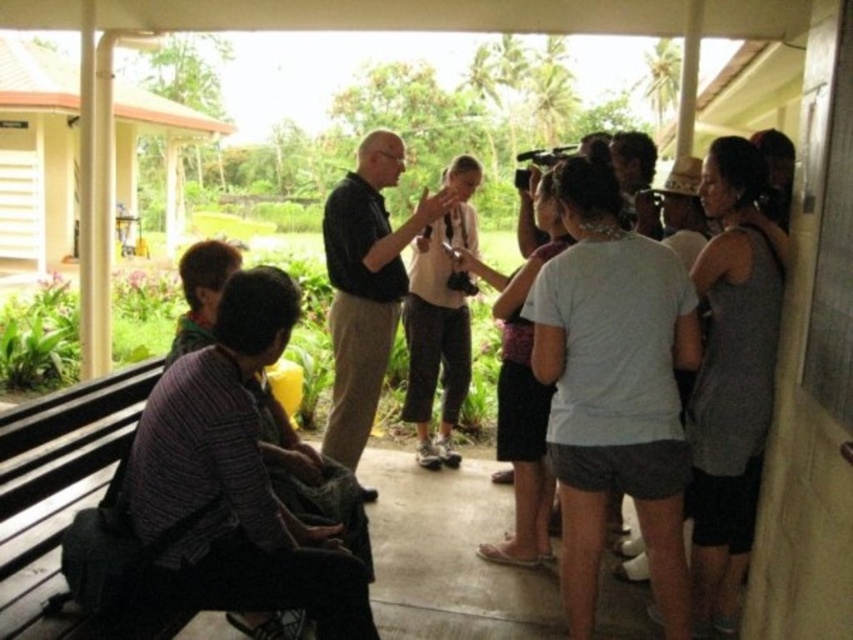
Consider the image. You are a photographer at the event and want to capture a photo of the group. You are currently standing behind the wooden bench at lower left. To frame the black matte shirt at center properly in your shot, should you move to your right or left?

The wooden bench at lower left is positioned on the left side of black matte shirt at center. To frame the black matte shirt at center properly, you should move to your right to align with the center of the scene.

You are a photographer at the event and need to capture a clear shot of the speaker wearing the black matte shirt at center without the wooden bench at lower left blocking the view. Is this possible based on their positions?

The wooden bench at lower left is positioned under the black matte shirt at center, so it is possible to capture a clear shot of the speaker without the bench blocking the view by angling the camera upwards or moving to a higher position.